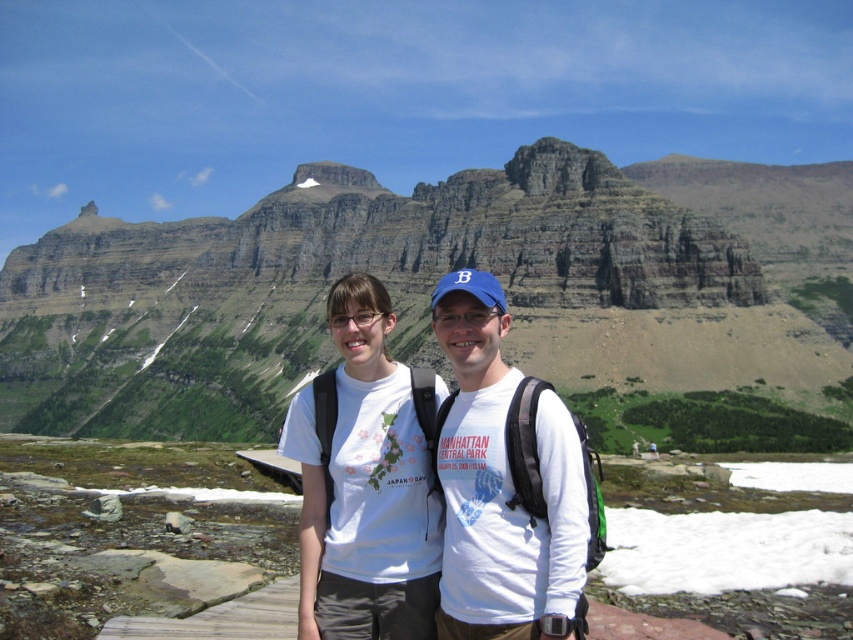
You are a hiker standing at the base of the rocky cliff at center. You want to reach the summit which is 100 meters away. Can you make it in one go without stopping?

The rocky cliff at center is 90.59 meters away from viewer, so yes, you can reach the summit in one go since it is within the 100 meters distance.

You are standing at the point marked as point (431,285) in the image. What is the terrain like at this location?

The point (431,285) marks a rocky cliff at center, so the terrain at this location is rocky and steep.